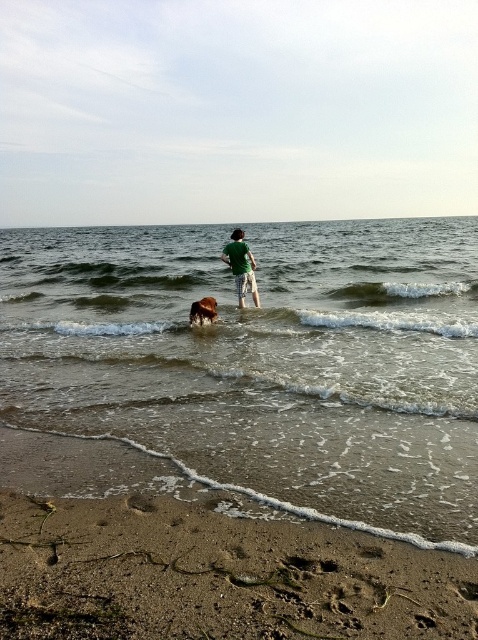
How far apart are clear water at center and green matte shirt at center?

clear water at center and green matte shirt at center are 37.44 meters apart from each other.

Who is shorter, clear water at center or green matte shirt at center?

Standing shorter between the two is green matte shirt at center.

Is point (148, 333) farther from camera compared to point (238, 230)?

No, it is in front of (238, 230).

At what (x,y) coordinates should I click in order to perform the action: click on clear water at center. Please return your answer as a coordinate pair (x, y). Looking at the image, I should click on (263, 362).

Is brown sandy beach at lower left to the right of brown furry dog at center from the viewer's perspective?

Indeed, brown sandy beach at lower left is positioned on the right side of brown furry dog at center.

What do you see at coordinates (216, 577) in the screenshot?
I see `brown sandy beach at lower left` at bounding box center [216, 577].

Between point (209, 621) and point (208, 296), which one is positioned in front?

Point (209, 621)

Image resolution: width=478 pixels, height=640 pixels. Identify the location of brown sandy beach at lower left. (216, 577).

Can you confirm if clear water at center is thinner than brown sandy beach at lower left?

No, clear water at center is not thinner than brown sandy beach at lower left.

This screenshot has height=640, width=478. Describe the element at coordinates (263, 362) in the screenshot. I see `clear water at center` at that location.

Does point (460, 513) come behind point (380, 632)?

Yes, it is.

This screenshot has height=640, width=478. I want to click on clear water at center, so click(x=263, y=362).